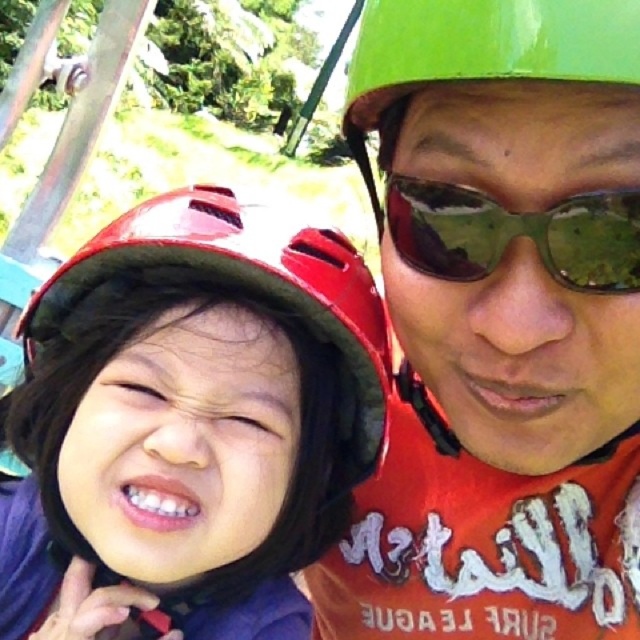
Question: In this image, where is green matte helmet at upper center located relative to green reflective sunglasses at upper center?

Choices:
 (A) below
 (B) above

Answer: (A)

Question: Among these objects, which one is farthest from the camera?

Choices:
 (A) glossy red helmet at left
 (B) green reflective sunglasses at upper center

Answer: (A)

Question: Which object is closer to the camera taking this photo?

Choices:
 (A) green reflective sunglasses at upper center
 (B) green matte helmet at upper center

Answer: (B)

Question: Which object is closer to the camera taking this photo?

Choices:
 (A) green reflective sunglasses at upper center
 (B) glossy red helmet at left
 (C) green matte helmet at upper center

Answer: (C)

Question: In this image, where is green matte helmet at upper center located relative to green reflective sunglasses at upper center?

Choices:
 (A) above
 (B) below

Answer: (B)

Question: Is glossy red helmet at left to the left of green matte helmet at upper center from the viewer's perspective?

Choices:
 (A) no
 (B) yes

Answer: (B)